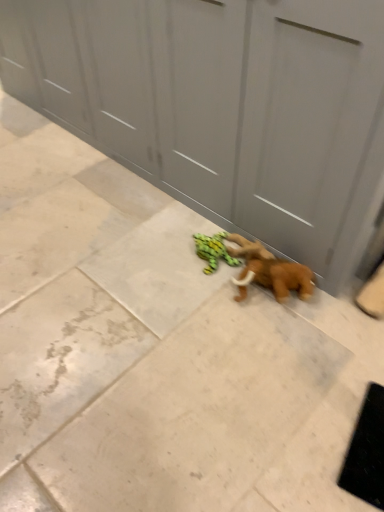
The width and height of the screenshot is (384, 512). Describe the element at coordinates (269, 271) in the screenshot. I see `brown plush elephant at lower center` at that location.

What are the coordinates of `brown plush elephant at lower center` in the screenshot? It's located at (269, 271).

Where is `brown plush elephant at lower center`? The image size is (384, 512). brown plush elephant at lower center is located at coordinates [x=269, y=271].